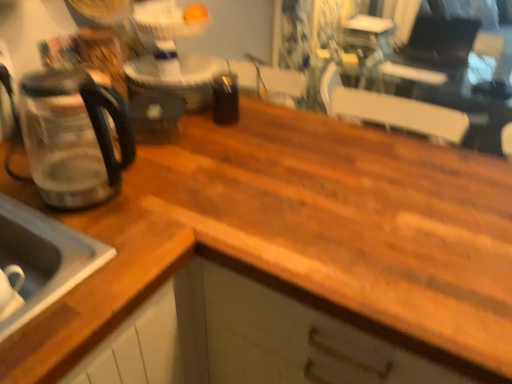
Question: Choose the correct answer: Is satin silver sink at lower left inside transparent glass coffeepot at left or outside it?

Choices:
 (A) outside
 (B) inside

Answer: (A)

Question: From the image's perspective, relative to transparent glass coffeepot at left, is satin silver sink at lower left above or below?

Choices:
 (A) below
 (B) above

Answer: (A)

Question: From a real-world perspective, is satin silver sink at lower left positioned above or below transparent glass coffeepot at left?

Choices:
 (A) below
 (B) above

Answer: (A)

Question: Looking at the image, does transparent glass coffeepot at left seem bigger or smaller compared to satin silver sink at lower left?

Choices:
 (A) big
 (B) small

Answer: (B)

Question: From a real-world perspective, is transparent glass coffeepot at left above or below satin silver sink at lower left?

Choices:
 (A) below
 (B) above

Answer: (B)

Question: In the image, is transparent glass coffeepot at left positioned in front of or behind satin silver sink at lower left?

Choices:
 (A) behind
 (B) front

Answer: (A)

Question: From the image's perspective, is transparent glass coffeepot at left located above or below satin silver sink at lower left?

Choices:
 (A) below
 (B) above

Answer: (B)